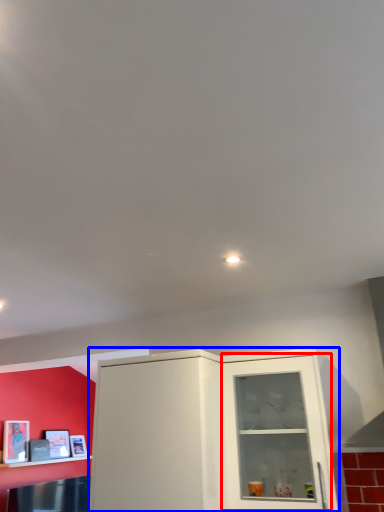
Question: Which object is further to the camera taking this photo, glass door (highlighted by a red box) or cabinetry (highlighted by a blue box)?

Choices:
 (A) glass door
 (B) cabinetry

Answer: (A)